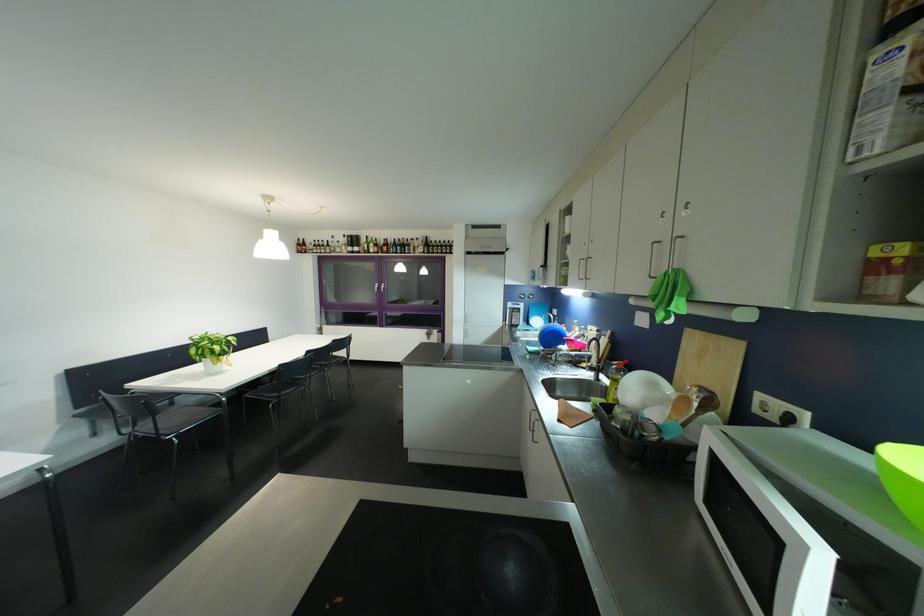
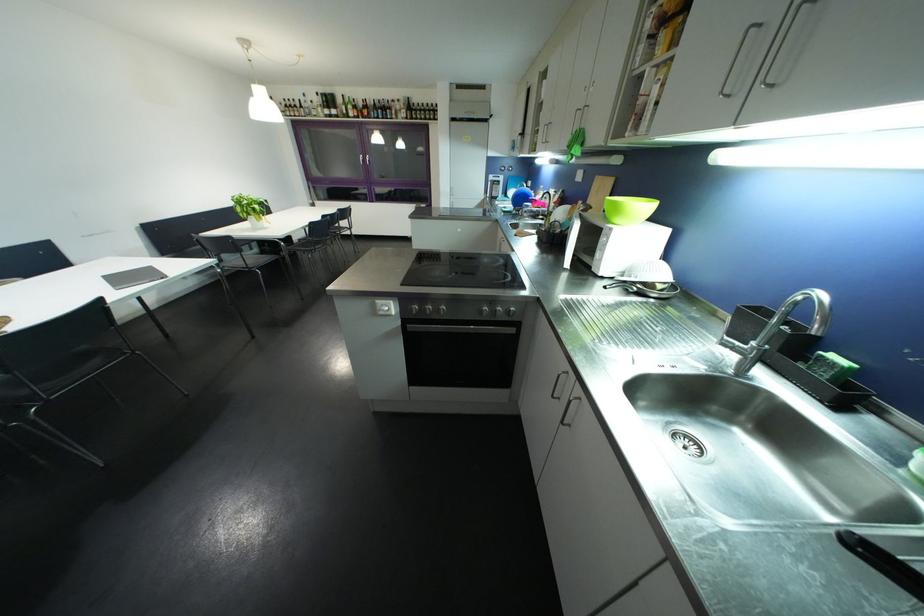
The point at (200, 354) is marked in the first image. Where is the corresponding point in the second image?

(246, 212)